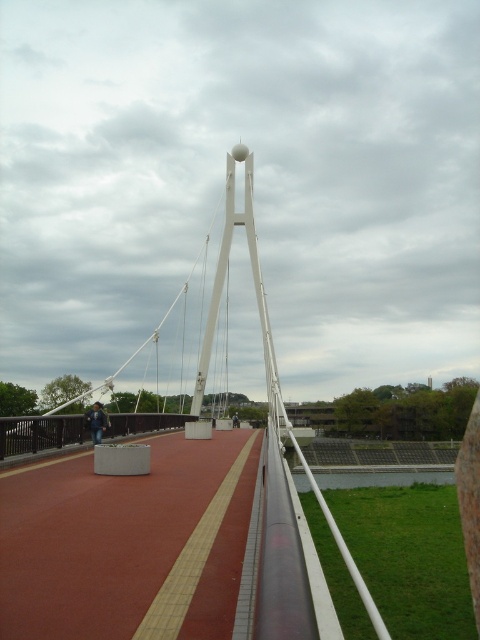
Who is taller, red rubber path at center or dark blue jeans at left?

Standing taller between the two is red rubber path at center.

Is red rubber path at center bigger than dark blue jeans at left?

Correct, red rubber path at center is larger in size than dark blue jeans at left.

Where is `red rubber path at center`? The width and height of the screenshot is (480, 640). red rubber path at center is located at coordinates (129, 545).

The image size is (480, 640). I want to click on red rubber path at center, so click(129, 545).

Can you confirm if white metallic suspension bridge at center is taller than dark blue jeans at left?

Yes.

Who is more distant from viewer, (x=47, y=538) or (x=101, y=406)?

The point (x=101, y=406) is more distant.

You are a GUI agent. You are given a task and a screenshot of the screen. Output one action in this format:
    pyautogui.click(x=<x>, y=<y>)
    Task: Click on the white metallic suspension bridge at center
    The height and width of the screenshot is (640, 480).
    Given the screenshot: What is the action you would take?
    pyautogui.click(x=120, y=544)

From the picture: Is white metallic suspension bridge at center to the left of red rubber path at center from the viewer's perspective?

No, white metallic suspension bridge at center is not to the left of red rubber path at center.

Is point (92, 632) in front of point (50, 624)?

Yes, point (92, 632) is in front of point (50, 624).

Which is behind, point (260, 584) or point (72, 529)?

The point (72, 529) is more distant.

Find the location of a particular element. The image size is (480, 640). white metallic suspension bridge at center is located at coordinates (120, 544).